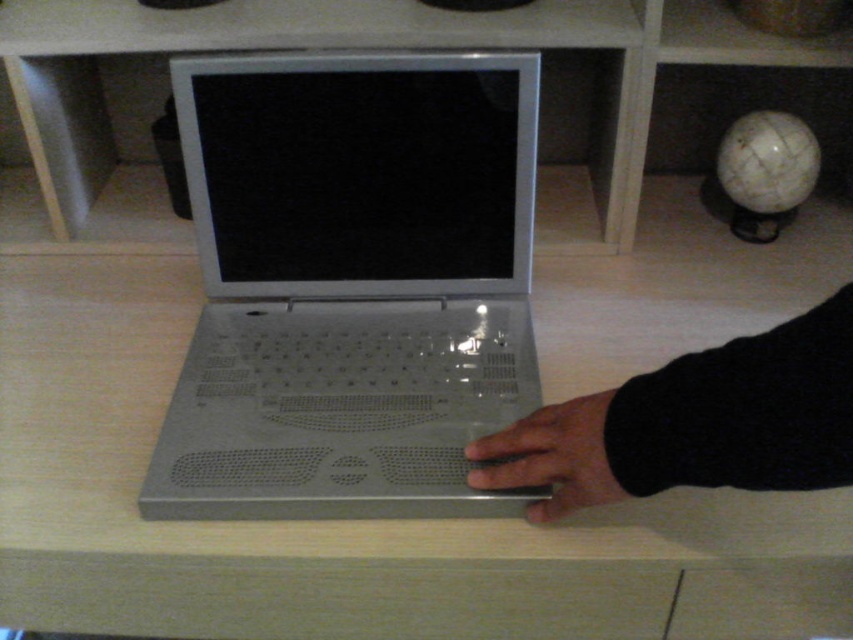
How distant is silver metallic laptop at center from black matte hand at center?

The distance of silver metallic laptop at center from black matte hand at center is 8.14 inches.

Is silver metallic laptop at center taller than black matte hand at center?

Yes, silver metallic laptop at center is taller than black matte hand at center.

The width and height of the screenshot is (853, 640). I want to click on silver metallic laptop at center, so tap(352, 284).

Who is lower down, matte silver laptop at center or black matte hand at center?

Positioned lower is black matte hand at center.

Can you confirm if matte silver laptop at center is smaller than black matte hand at center?

No, matte silver laptop at center is not smaller than black matte hand at center.

Between point (318, 609) and point (552, 513), which one is positioned behind?

The point (318, 609) is behind.

You are a GUI agent. You are given a task and a screenshot of the screen. Output one action in this format:
    pyautogui.click(x=<x>, y=<y>)
    Task: Click on the matte silver laptop at center
    The width and height of the screenshot is (853, 640).
    Given the screenshot: What is the action you would take?
    pyautogui.click(x=300, y=522)

Find the location of a particular element. The height and width of the screenshot is (640, 853). matte silver laptop at center is located at coordinates (300, 522).

Who is shorter, matte silver laptop at center or silver metallic laptop at center?

Standing shorter between the two is matte silver laptop at center.

What do you see at coordinates (300, 522) in the screenshot?
I see `matte silver laptop at center` at bounding box center [300, 522].

Locate an element on the screen. matte silver laptop at center is located at coordinates tap(300, 522).